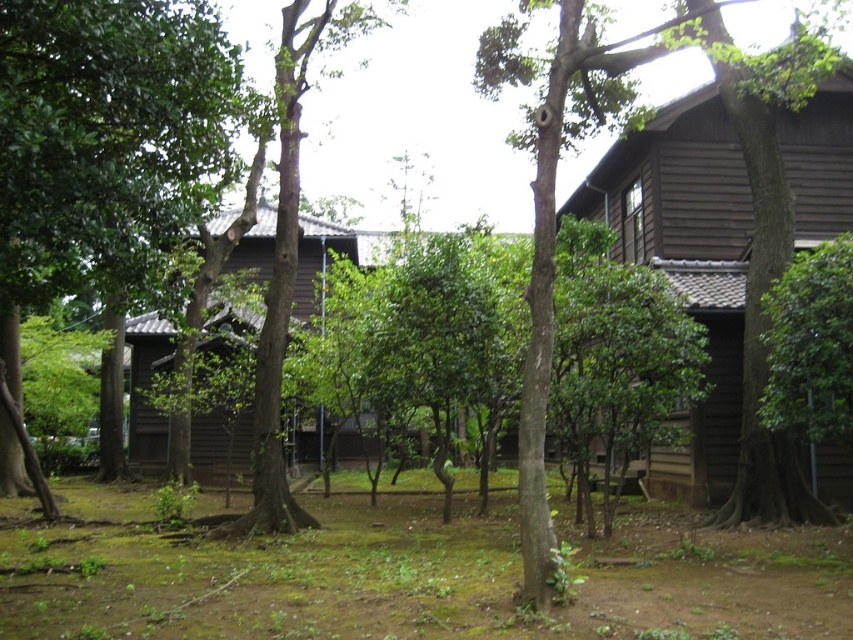
I want to click on green leafy tree at center, so click(108, 136).

Who is taller, green leafy tree at center or brown wooden hut at center?

Standing taller between the two is brown wooden hut at center.

Is point (9, 65) positioned before point (274, 224)?

That is True.

At what (x,y) coordinates should I click in order to perform the action: click on green leafy tree at center. Please return your answer as a coordinate pair (x, y). The image size is (853, 640). Looking at the image, I should click on [108, 136].

Is green matte tree at center thinner than brown wooden hut at center?

Yes, green matte tree at center is thinner than brown wooden hut at center.

Is green matte tree at center positioned in front of brown wooden hut at center?

Yes, it is in front of brown wooden hut at center.

At what (x,y) coordinates should I click in order to perform the action: click on green matte tree at center. Please return your answer as a coordinate pair (x, y). The height and width of the screenshot is (640, 853). Looking at the image, I should click on (287, 260).

How distant is green mossy ground at center from wooden hut at right?

The distance of green mossy ground at center from wooden hut at right is 5.55 meters.

Measure the distance between green mossy ground at center and camera.

5.33 meters

Which is in front, point (88, 488) or point (706, 268)?

Positioned in front is point (706, 268).

Find the location of a particular element. The width and height of the screenshot is (853, 640). green mossy ground at center is located at coordinates (425, 580).